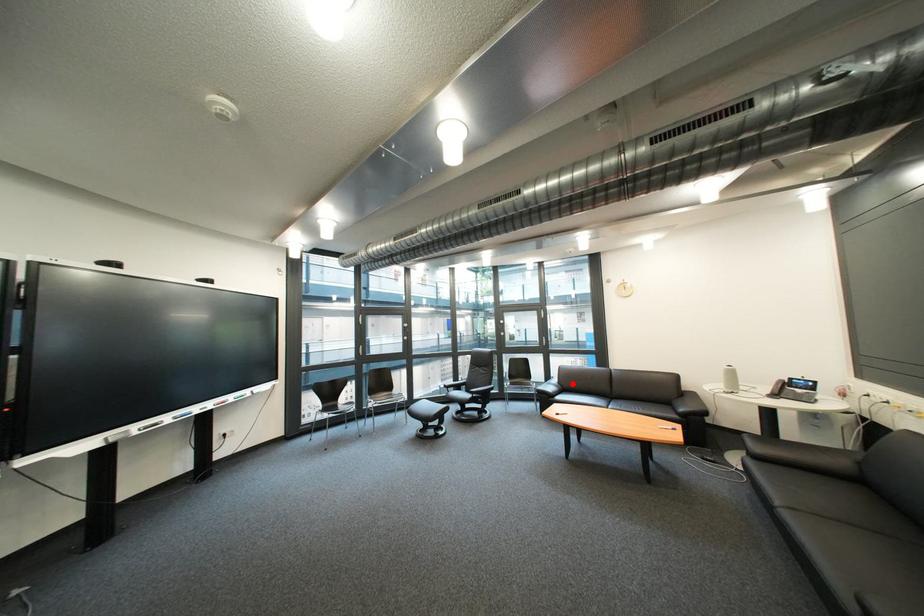
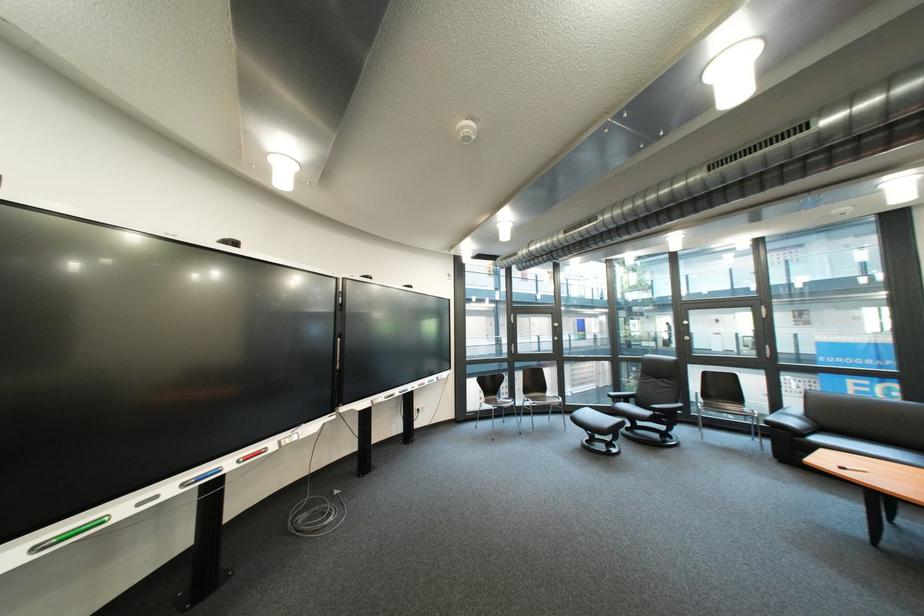
Locate, in the second image, the point that corresponds to the highlighted location in the first image.

(822, 418)